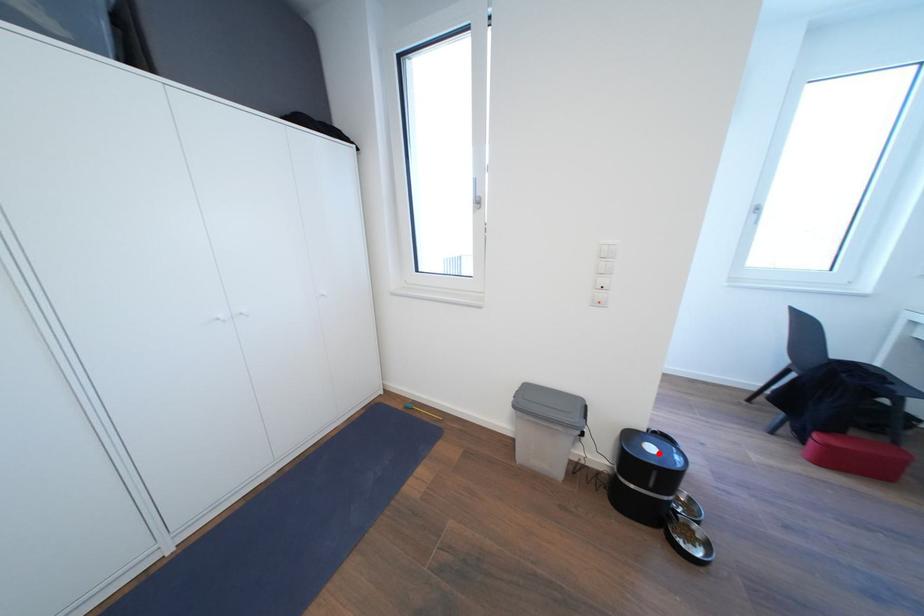
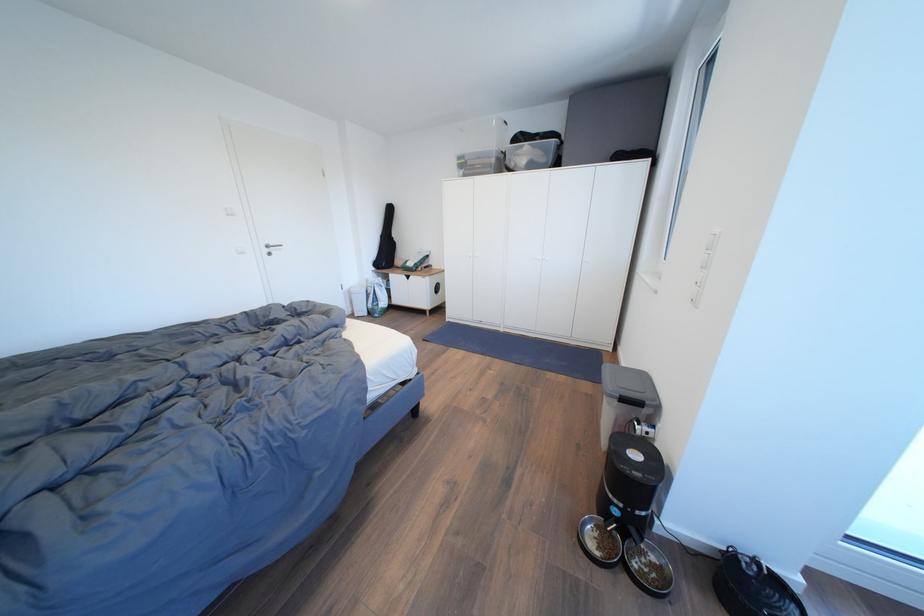
Question: I am providing you with two images of the same scene from different viewpoints. A red point is marked on the first image. At the location where the point appears in image 1, is it still visible in image 2?

Choices:
 (A) Yes
 (B) No

Answer: (A)